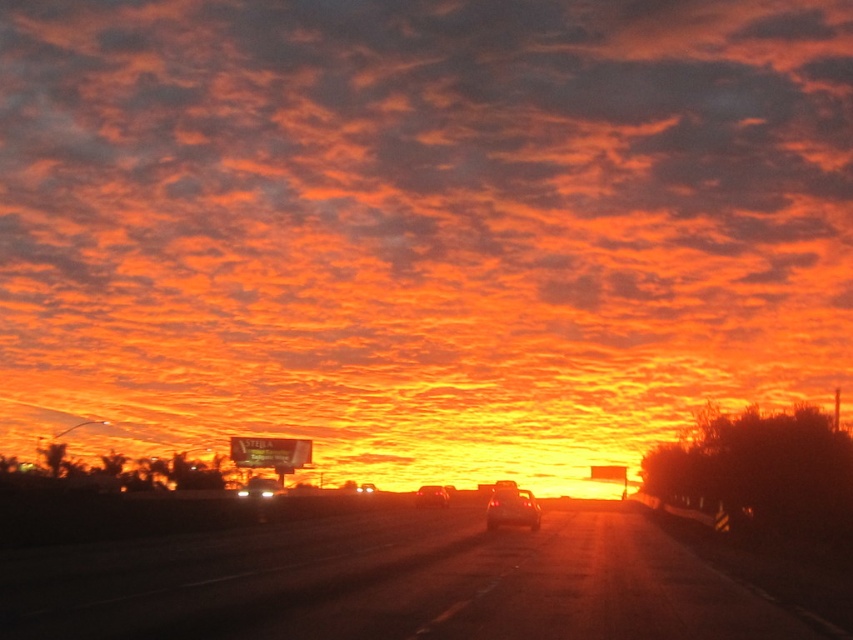
Question: Is smooth asphalt highway at center further to the viewer compared to shiny silver sedan at center?

Choices:
 (A) no
 (B) yes

Answer: (A)

Question: Which of these objects is positioned farthest from the shiny silver sedan at center?

Choices:
 (A) shiny metallic car at center
 (B) smooth asphalt highway at center

Answer: (B)

Question: Can you confirm if shiny metallic car at center is positioned below shiny silver sedan at center?

Choices:
 (A) no
 (B) yes

Answer: (A)

Question: Observing the image, what is the correct spatial positioning of smooth asphalt highway at center in reference to shiny metallic car at center?

Choices:
 (A) below
 (B) above

Answer: (B)

Question: Among these objects, which one is nearest to the camera?

Choices:
 (A) smooth asphalt highway at center
 (B) shiny metallic car at center
 (C) shiny silver sedan at center

Answer: (A)

Question: Which object is closer to the camera taking this photo?

Choices:
 (A) shiny silver sedan at center
 (B) smooth asphalt highway at center

Answer: (B)